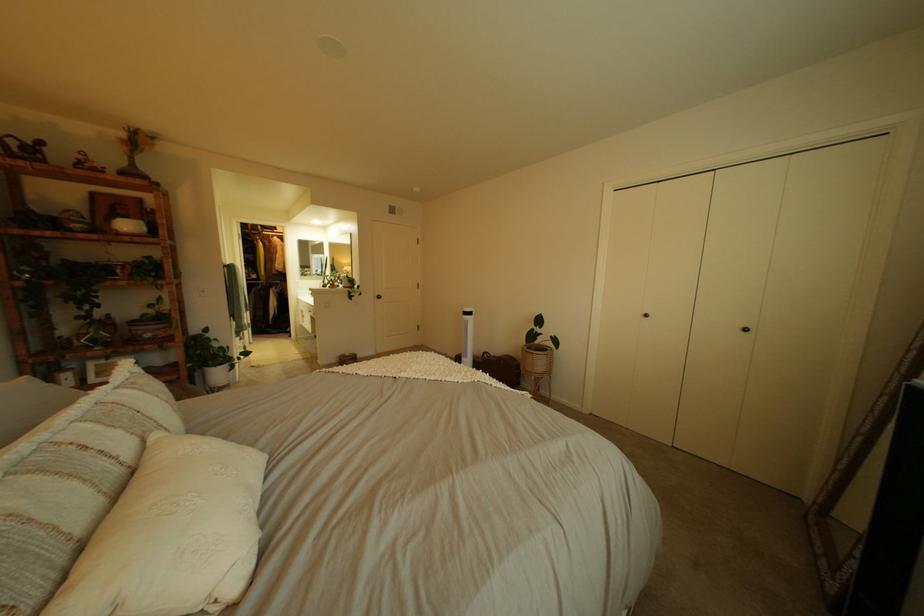
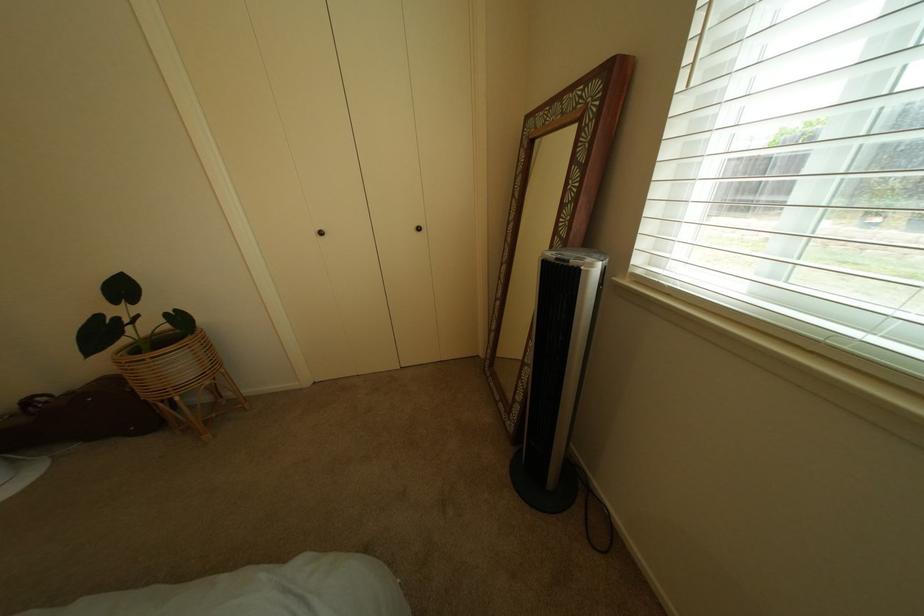
First-person continuous shooting, in which direction is the camera rotating?

The rotation direction of the camera is right-down.